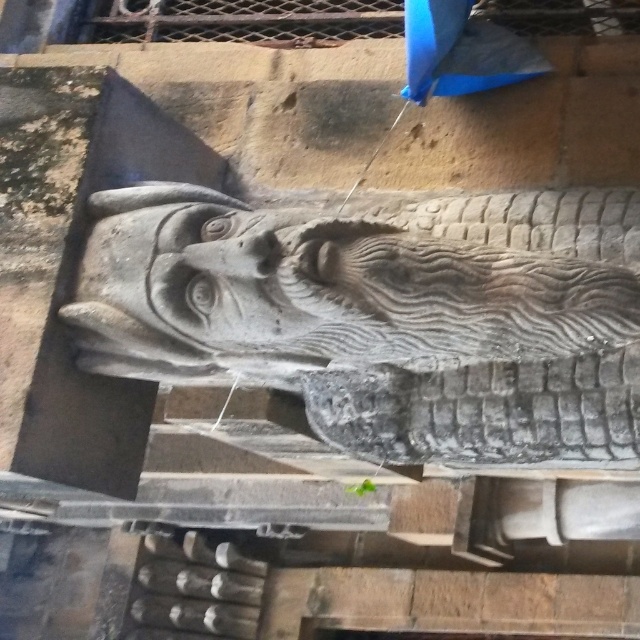
Question: Is gray stone dragon at center above blue fabric umbrella at upper center?

Choices:
 (A) yes
 (B) no

Answer: (B)

Question: Which point is closer to the camera taking this photo?

Choices:
 (A) (570, 228)
 (B) (513, 54)

Answer: (A)

Question: Is gray stone dragon at center behind blue fabric umbrella at upper center?

Choices:
 (A) no
 (B) yes

Answer: (A)

Question: Which point is closer to the camera?

Choices:
 (A) tap(385, 253)
 (B) tap(497, 49)

Answer: (A)

Question: Does gray stone dragon at center have a lesser width compared to blue fabric umbrella at upper center?

Choices:
 (A) yes
 (B) no

Answer: (B)